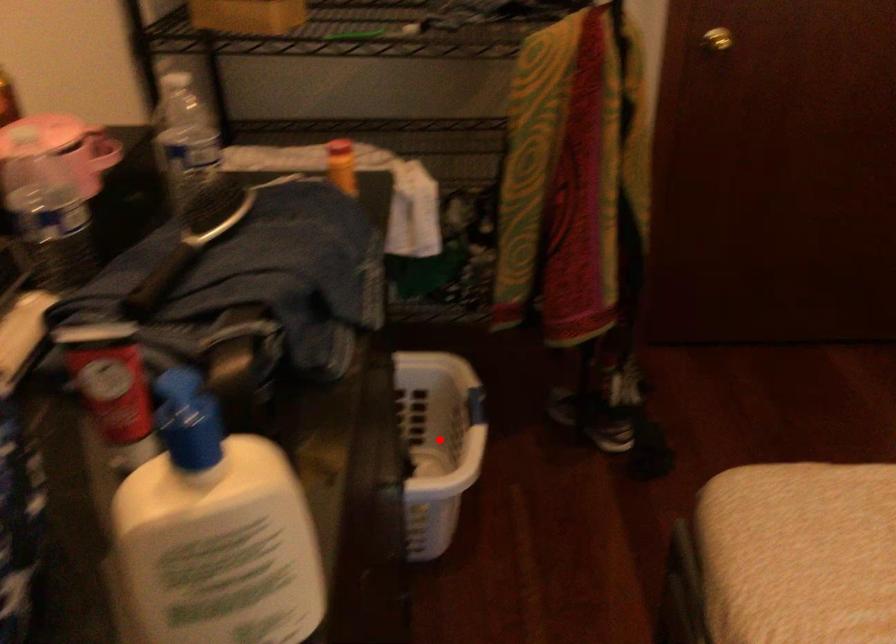
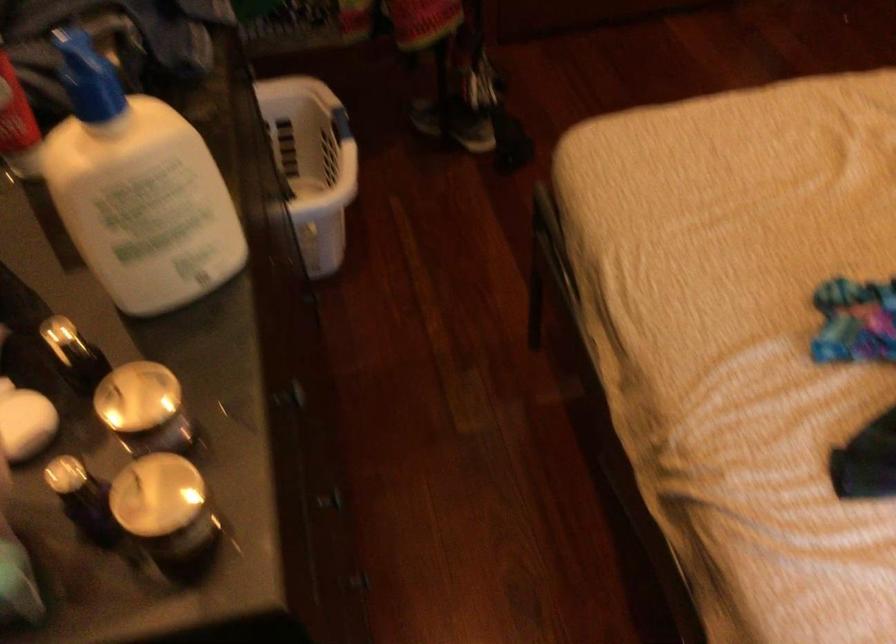
In the second image, find the point that corresponds to the highlighted location in the first image.

(312, 164)